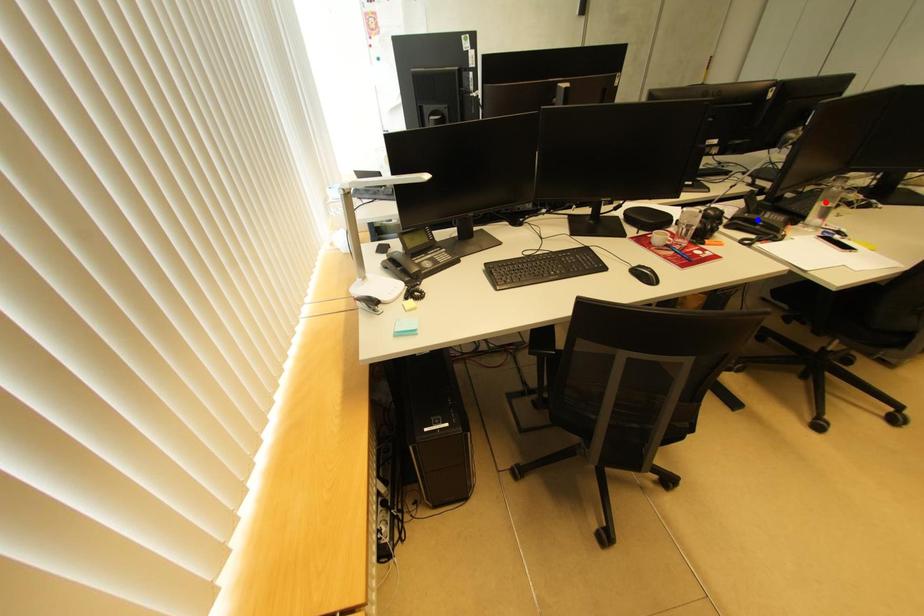
Question: Which of the two points in the image is closer to the camera?

Choices:
 (A) Blue point is closer.
 (B) Red point is closer.

Answer: (B)